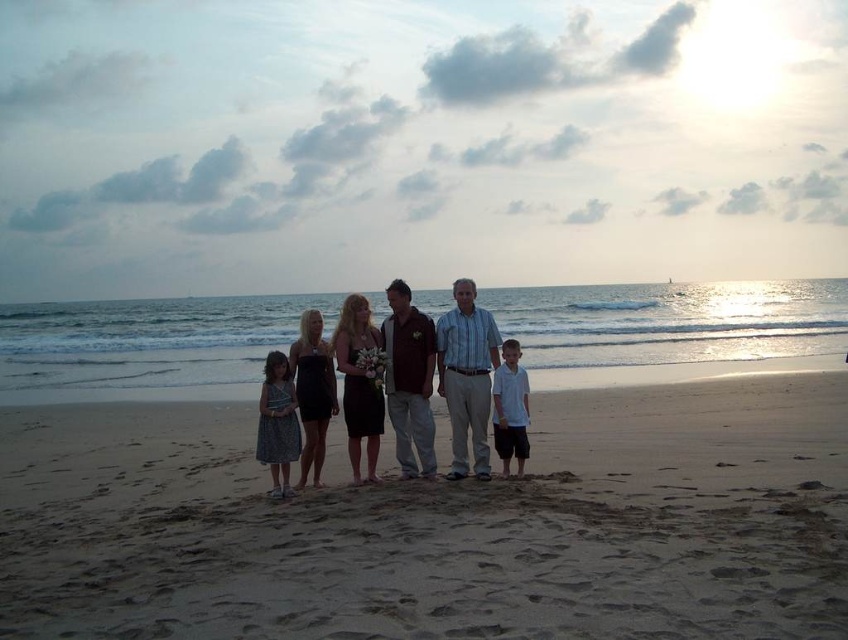
Is matte black dress at center smaller than white cotton shirt at center?

No.

Who is more forward, (399,320) or (511,452)?

Point (511,452) is in front.

Is point (354, 461) positioned behind point (506, 429)?

That is True.

Where is `matte black dress at center`? The height and width of the screenshot is (640, 848). matte black dress at center is located at coordinates (385, 378).

Is light brown sand at center positioned at the back of matte black dress at center?

That is False.

Is light brown sand at center to the right of matte black dress at center from the viewer's perspective?

Correct, you'll find light brown sand at center to the right of matte black dress at center.

This screenshot has height=640, width=848. What do you see at coordinates (438, 525) in the screenshot?
I see `light brown sand at center` at bounding box center [438, 525].

Identify the location of light brown sand at center. 438,525.

Is light brown sand at center smaller than white cotton shirt at center?

No.

Can you confirm if light brown sand at center is thinner than white cotton shirt at center?

Incorrect, light brown sand at center's width is not less than white cotton shirt at center's.

Between point (746, 561) and point (499, 387), which one is positioned in front?

Point (746, 561) is more forward.

The image size is (848, 640). Find the location of `light brown sand at center`. light brown sand at center is located at coordinates (438, 525).